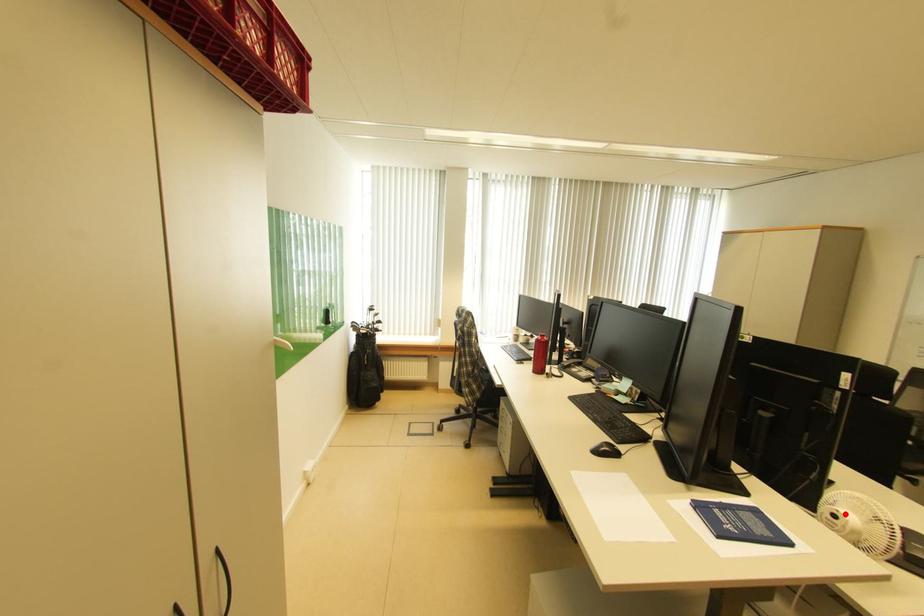
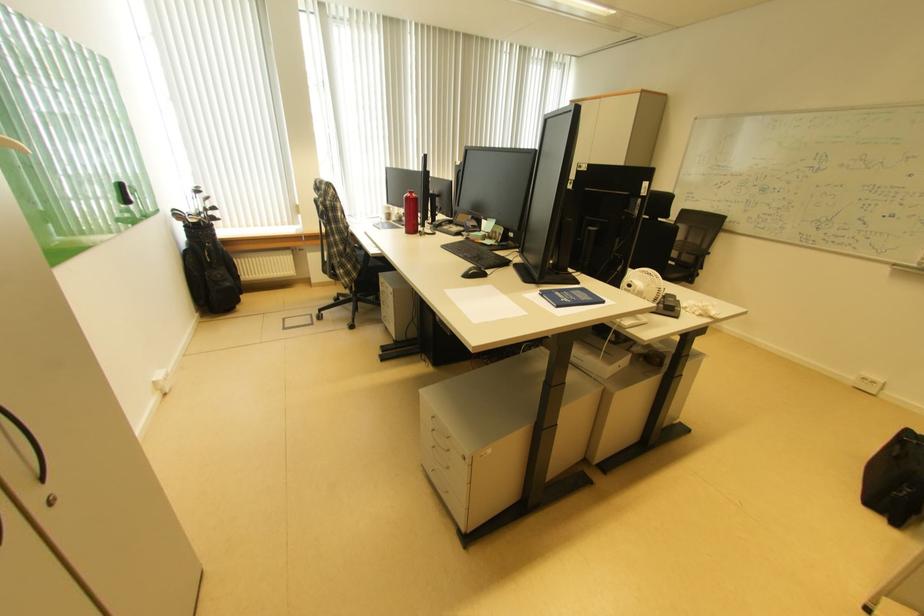
Question: I am providing you with two images of the same scene from different viewpoints. A red point is shown in image1. For the corresponding object point in image2, is it positioned nearer or farther from the camera?

Choices:
 (A) Nearer
 (B) Farther

Answer: (B)